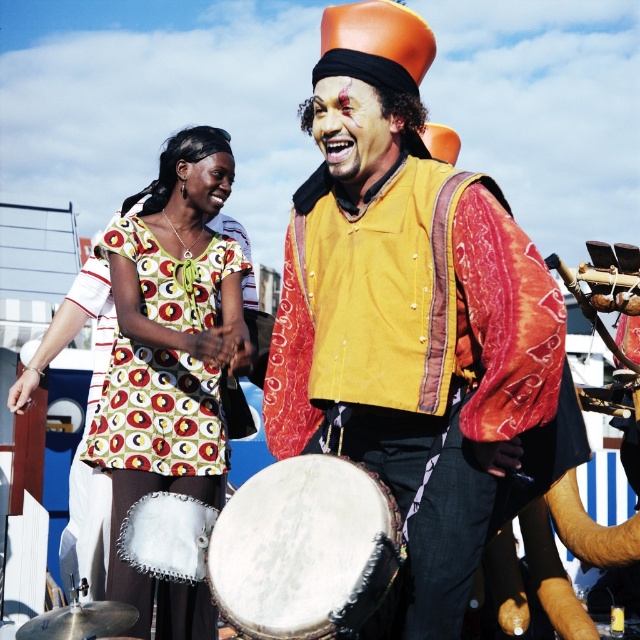
Does printed fabric dress at center appear over printed fabric dress at left?

Yes, printed fabric dress at center is above printed fabric dress at left.

Based on the photo, who is positioned more to the right, printed fabric dress at center or printed fabric dress at left?

Positioned to the right is printed fabric dress at center.

Is point (200, 413) behind point (115, 364)?

Yes, point (200, 413) is farther from viewer.

Where is `printed fabric dress at center`? The width and height of the screenshot is (640, 640). printed fabric dress at center is located at coordinates (166, 356).

Between printed fabric dress at center and white leather drum at center, which one has less height?

white leather drum at center is shorter.

Is printed fabric dress at center in front of white leather drum at center?

No, it is not.

Where is `printed fabric dress at center`? printed fabric dress at center is located at coordinates (166, 356).

Does matte yellow vest at center appear under matte skin face at center?

Answer: Correct, matte yellow vest at center is located below matte skin face at center.

Does matte yellow vest at center have a lesser width compared to matte skin face at center?

Incorrect, matte yellow vest at center's width is not less than matte skin face at center's.

Find the location of `matte yellow vest at center`. matte yellow vest at center is located at coordinates (417, 328).